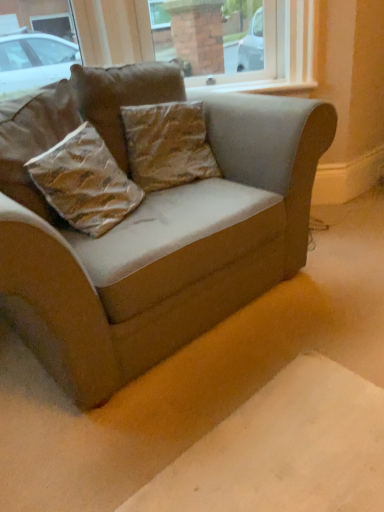
Question: Which direction should I rotate to face brown textured pillow at center, which appears as the 1th pillow when viewed from the top, — up or down?

Choices:
 (A) down
 (B) up

Answer: (B)

Question: Is brown textured pillow at center, the 3th pillow ordered from the bottom, oriented towards velvet beige couch at center?

Choices:
 (A) yes
 (B) no

Answer: (A)

Question: Can you confirm if brown textured pillow at center, which appears as the 1th pillow when viewed from the top, is smaller than velvet beige couch at center?

Choices:
 (A) no
 (B) yes

Answer: (B)

Question: Considering the relative positions of brown textured pillow at center, the 3th pillow ordered from the bottom, and velvet beige couch at center in the image provided, is brown textured pillow at center, the 3th pillow ordered from the bottom, to the left of velvet beige couch at center from the viewer's perspective?

Choices:
 (A) yes
 (B) no

Answer: (B)

Question: From a real-world perspective, is brown textured pillow at center, which appears as the 1th pillow when viewed from the top, positioned over velvet beige couch at center based on gravity?

Choices:
 (A) no
 (B) yes

Answer: (B)

Question: Does brown textured pillow at center, the 3th pillow ordered from the bottom, come behind velvet beige couch at center?

Choices:
 (A) no
 (B) yes

Answer: (B)

Question: Can we say brown textured pillow at center, the 3th pillow ordered from the bottom, lies outside velvet beige couch at center?

Choices:
 (A) no
 (B) yes

Answer: (A)

Question: Would you say brown textured pillow at center, acting as the third pillow starting from the top, is part of brown textured pillow at center, which is counted as the 2th pillow, starting from the bottom,'s contents?

Choices:
 (A) no
 (B) yes

Answer: (A)

Question: Is brown textured pillow at center, the 2th pillow from the top, outside brown textured pillow at center, the first pillow when ordered from bottom to top?

Choices:
 (A) yes
 (B) no

Answer: (A)

Question: Is brown textured pillow at center, which is counted as the 2th pillow, starting from the bottom, not close to brown textured pillow at center, acting as the third pillow starting from the top?

Choices:
 (A) no
 (B) yes

Answer: (A)

Question: Is brown textured pillow at center, which is counted as the 2th pillow, starting from the bottom, wider than brown textured pillow at center, the first pillow when ordered from bottom to top?

Choices:
 (A) yes
 (B) no

Answer: (B)

Question: Is the depth of brown textured pillow at center, which is counted as the 2th pillow, starting from the bottom, greater than that of brown textured pillow at center, the first pillow when ordered from bottom to top?

Choices:
 (A) yes
 (B) no

Answer: (A)

Question: From a real-world perspective, is brown textured pillow at center, the 2th pillow from the top, physically below brown textured pillow at center, acting as the third pillow starting from the top?

Choices:
 (A) no
 (B) yes

Answer: (A)

Question: Is brown textured pillow at center, the first pillow when ordered from bottom to top, positioned with its back to brown textured pillow at center, which is counted as the 2th pillow, starting from the bottom?

Choices:
 (A) yes
 (B) no

Answer: (B)